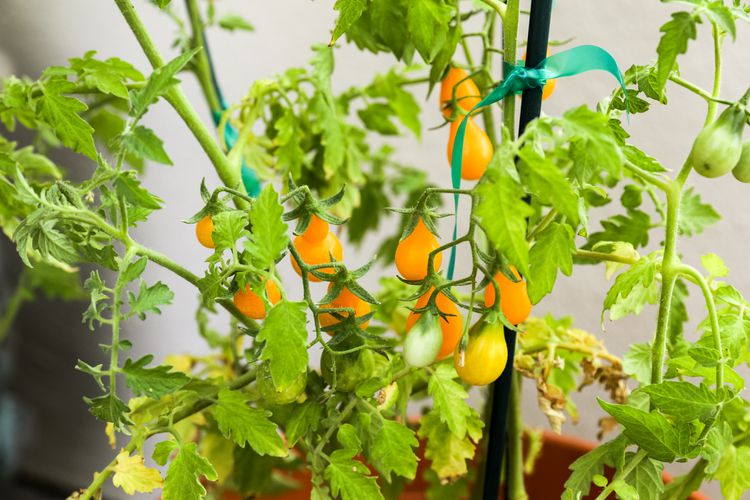
I want to click on teracotta planter, so click(546, 455).